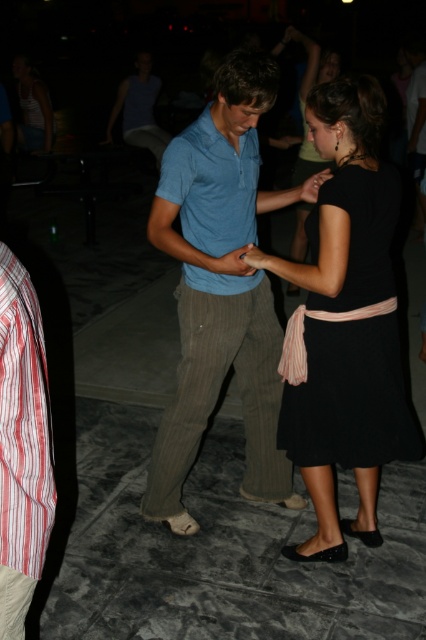
Does blue cotton shirt at center lie behind khaki pants at lower left?

Yes, blue cotton shirt at center is behind khaki pants at lower left.

Who is positioned more to the left, blue cotton shirt at center or khaki pants at lower left?

From the viewer's perspective, khaki pants at lower left appears more on the left side.

Who is more forward, (x=250, y=296) or (x=31, y=362)?

Positioned in front is point (x=31, y=362).

The image size is (426, 640). What are the coordinates of `blue cotton shirt at center` in the screenshot? It's located at (221, 289).

Does khaki pants at lower left have a larger size compared to matte blue polo shirt at center?

No.

Does khaki pants at lower left come in front of matte blue polo shirt at center?

That is True.

I want to click on khaki pants at lower left, so click(x=22, y=445).

The height and width of the screenshot is (640, 426). What are the coordinates of `khaki pants at lower left` in the screenshot? It's located at (22, 445).

From the picture: Can you confirm if black satin dress at center is taller than khaki pants at lower left?

Yes.

Does point (331, 422) come behind point (23, 314)?

That is True.

Find the location of `black satin dress at center`. black satin dress at center is located at coordinates (350, 397).